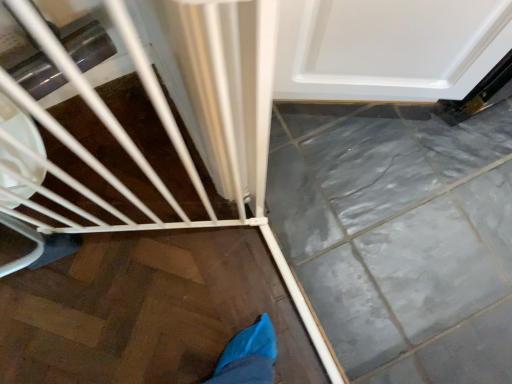
Question: Is white glossy door at upper right taller or shorter than white matte baby carriage at lower left?

Choices:
 (A) short
 (B) tall

Answer: (A)

Question: Do you think white glossy door at upper right is within white matte baby carriage at lower left, or outside of it?

Choices:
 (A) inside
 (B) outside

Answer: (B)

Question: Considering the positions of white glossy door at upper right and white matte baby carriage at lower left in the image, is white glossy door at upper right bigger or smaller than white matte baby carriage at lower left?

Choices:
 (A) small
 (B) big

Answer: (B)

Question: Is white matte baby carriage at lower left inside or outside of white glossy door at upper right?

Choices:
 (A) outside
 (B) inside

Answer: (A)

Question: In terms of size, does white matte baby carriage at lower left appear bigger or smaller than white glossy door at upper right?

Choices:
 (A) big
 (B) small

Answer: (B)

Question: Relative to white glossy door at upper right, is white matte baby carriage at lower left in front or behind?

Choices:
 (A) behind
 (B) front

Answer: (B)

Question: Based on their positions, is white matte baby carriage at lower left located to the left or right of white glossy door at upper right?

Choices:
 (A) right
 (B) left

Answer: (B)